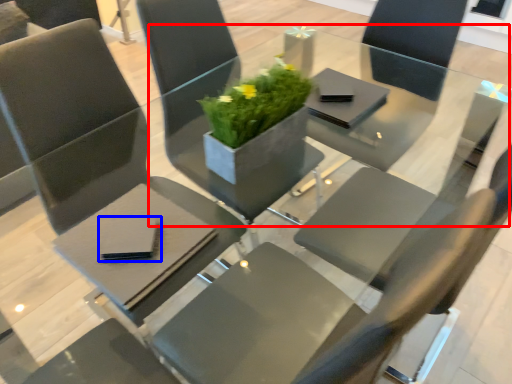
Question: Among these objects, which one is farthest to the camera, round table (highlighted by a red box) or pad (highlighted by a blue box)?

Choices:
 (A) round table
 (B) pad

Answer: (A)